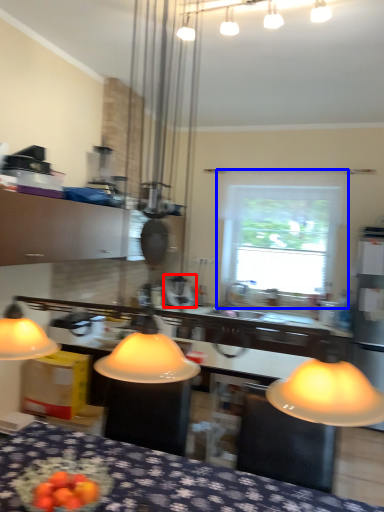
Question: Which point is closer to the camera, appliance (highlighted by a red box) or window (highlighted by a blue box)?

Choices:
 (A) appliance
 (B) window

Answer: (A)